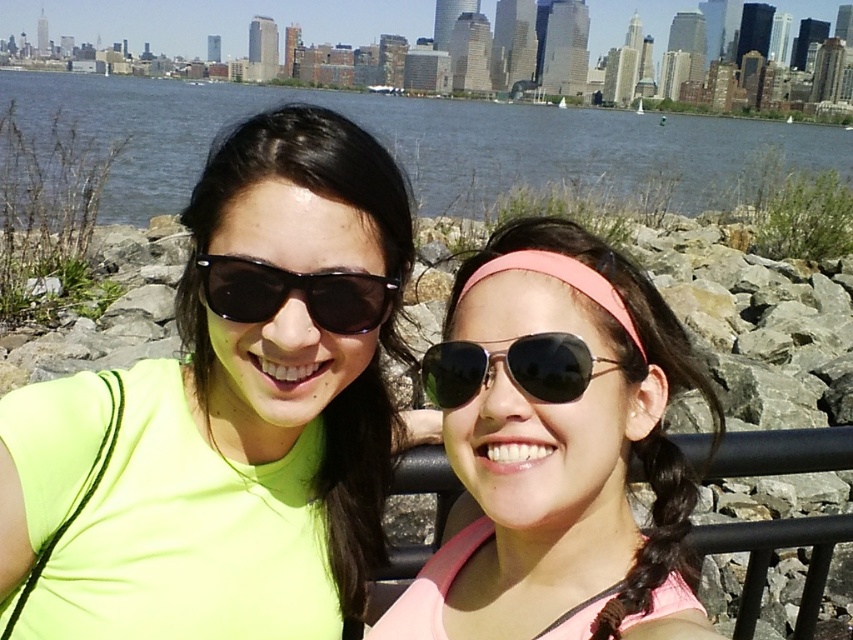
You are taking a selfie in the scene and want to focus on the two points marked in the image. Which point, point (326, 211) or point (350, 282), is closer to your camera lens?

Point (326, 211) is closer to the camera than point (350, 282).

In the scene shown: You are taking a photo of the neon yellow fabric at center and the black plastic sunglasses at center. Which object is positioned to the right side in the image?

The black plastic sunglasses at center is positioned to the right of the neon yellow fabric at center.